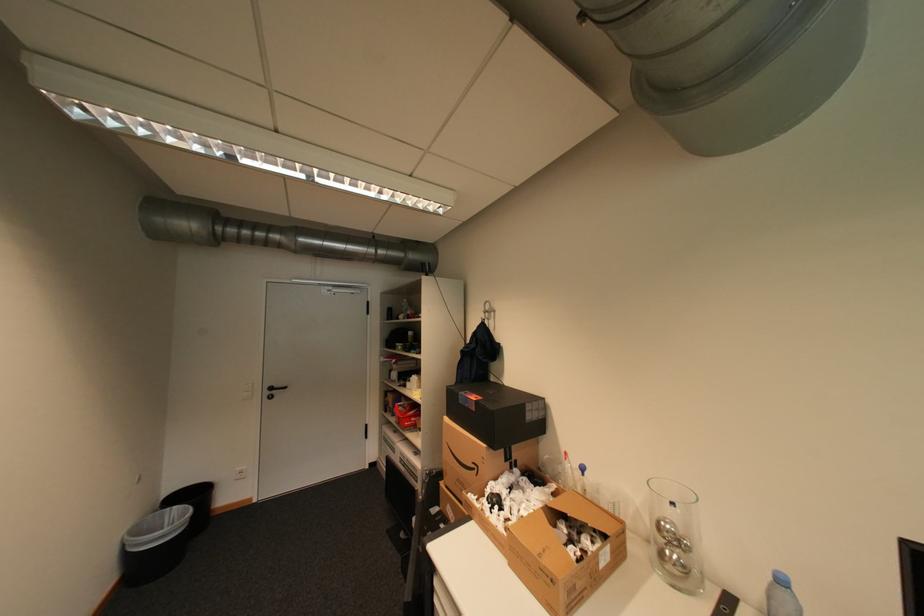
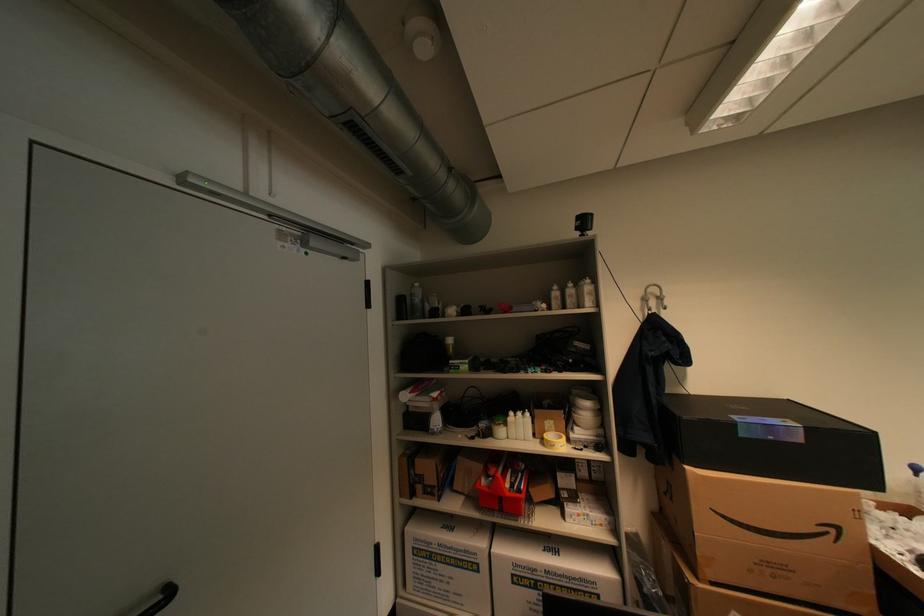
Find the pixel in the second image that matches (421,377) in the first image.

(519, 414)